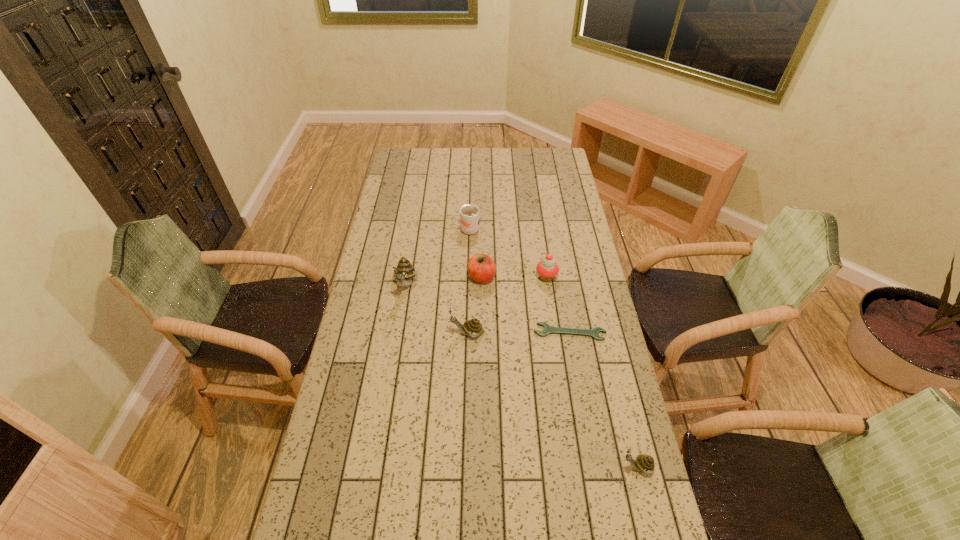
Locate an element on the screen. The width and height of the screenshot is (960, 540). the farthest snail is located at coordinates (404, 271).

This screenshot has height=540, width=960. In order to click on the tallest snail in this screenshot , I will do `click(404, 271)`.

This screenshot has width=960, height=540. I want to click on the second nearest snail, so click(x=473, y=327).

This screenshot has height=540, width=960. Identify the location of the second tallest snail. (473, 327).

Find the location of a particular element. The width and height of the screenshot is (960, 540). the shortest snail is located at coordinates (645, 463).

This screenshot has height=540, width=960. In order to click on the nearest snail in this screenshot , I will do (645, 463).

You are a GUI agent. You are given a task and a screenshot of the screen. Output one action in this format:
    pyautogui.click(x=<x>, y=<y>)
    Task: Click on the cupcake
    The image size is (960, 540).
    Given the screenshot: What is the action you would take?
    pyautogui.click(x=547, y=269)

Where is `the farthest object`? This screenshot has height=540, width=960. the farthest object is located at coordinates (469, 214).

You are a GUI agent. You are given a task and a screenshot of the screen. Output one action in this format:
    pyautogui.click(x=<x>, y=<y>)
    Task: Click on the wrench
    The image size is (960, 540).
    Given the screenshot: What is the action you would take?
    pyautogui.click(x=548, y=329)

Where is `apple`? Image resolution: width=960 pixels, height=540 pixels. apple is located at coordinates (481, 268).